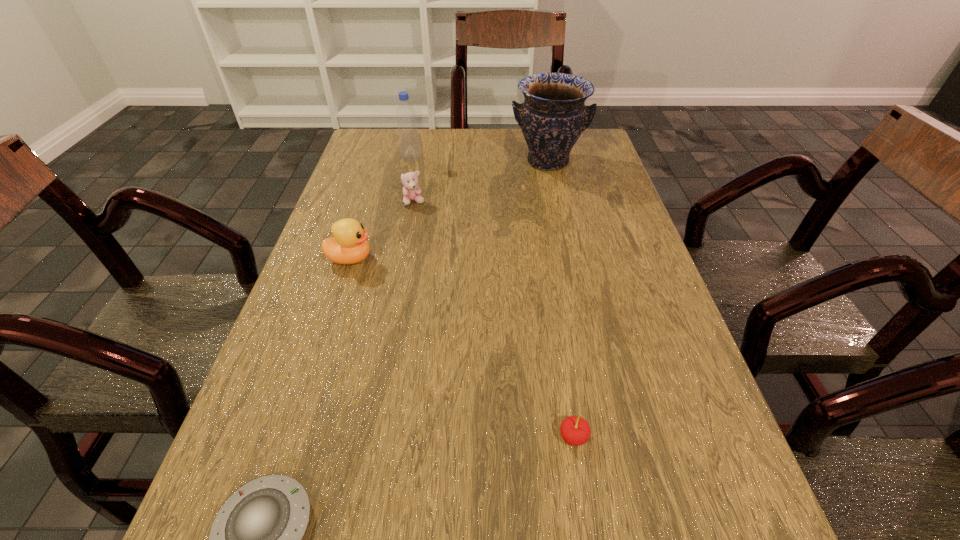
Identify the location of pottery. This screenshot has height=540, width=960. (553, 116).

You are a GUI agent. You are given a task and a screenshot of the screen. Output one action in this format:
    pyautogui.click(x=<x>, y=<y>)
    Task: Click on the bottle
    
    Given the screenshot: What is the action you would take?
    pyautogui.click(x=408, y=137)

Identify the location of duckling. (348, 246).

Find the location of a particular element. The image size is (960, 540). the fourth farthest object is located at coordinates (348, 246).

The image size is (960, 540). What are the coordinates of `the third farthest object` in the screenshot? It's located at (411, 190).

At what (x,y) coordinates should I click in order to perform the action: click on the second nearest object. Please return your answer as a coordinate pair (x, y). The height and width of the screenshot is (540, 960). Looking at the image, I should click on (575, 431).

Locate an element on the screen. The height and width of the screenshot is (540, 960). free space located 0.130m on the front handle of the pottery is located at coordinates (558, 207).

Image resolution: width=960 pixels, height=540 pixels. I want to click on blank area located 0.070m on the back of the bottle, so click(415, 143).

Where is `free spot located on the face of the third nearest object`? The width and height of the screenshot is (960, 540). free spot located on the face of the third nearest object is located at coordinates (529, 259).

The image size is (960, 540). What are the coordinates of `free region located 0.350m at the face of the teddy bear` in the screenshot? It's located at (394, 312).